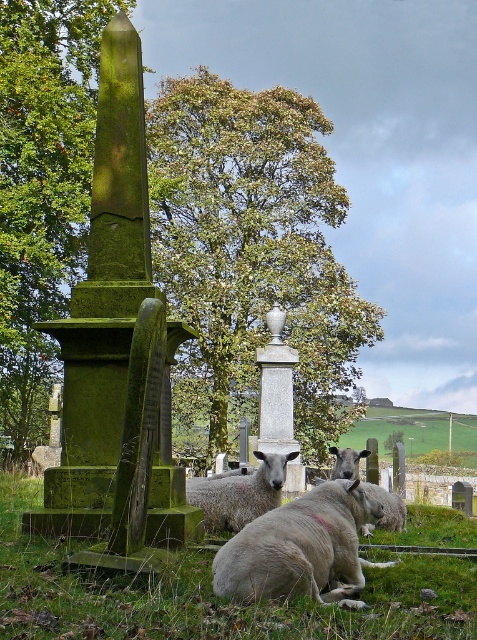
Question: Does green mossy stone obelisk at left have a lesser width compared to fuzzy woolen sheep at lower center?

Choices:
 (A) yes
 (B) no

Answer: (B)

Question: Estimate the real-world distances between objects in this image. Which object is farther from the fuzzy woolen sheep at lower center?

Choices:
 (A) green mossy stone obelisk at left
 (B) green grassy at center
 (C) gray woolen sheep at center
 (D) fuzzy woolly sheep at center

Answer: (A)

Question: Is fuzzy woolly sheep at center thinner than gray woolen sheep at center?

Choices:
 (A) no
 (B) yes

Answer: (B)

Question: Which point is farther from the camera taking this photo?

Choices:
 (A) (384, 500)
 (B) (91, 4)
 (C) (276, 579)

Answer: (B)

Question: Does green grassy at center appear on the left side of fuzzy woolen sheep at lower center?

Choices:
 (A) no
 (B) yes

Answer: (B)

Question: Which point appears farthest from the camera in this image?

Choices:
 (A) (349, 502)
 (B) (203, 509)
 (C) (87, 192)
 (D) (304, 193)

Answer: (D)